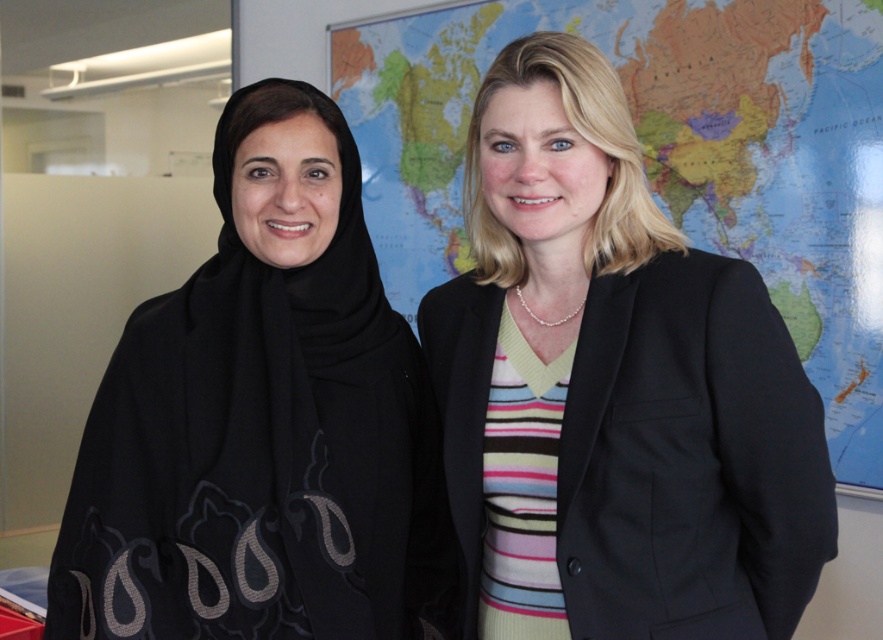
Consider the image. Between black matte scarf at left and map at center, which one is positioned lower?

black matte scarf at left

Is point (69, 616) positioned before point (828, 140)?

That is True.

You are a GUI agent. You are given a task and a screenshot of the screen. Output one action in this format:
    pyautogui.click(x=<x>, y=<y>)
    Task: Click on the black matte scarf at left
    Image resolution: width=883 pixels, height=640 pixels.
    Given the screenshot: What is the action you would take?
    pyautogui.click(x=263, y=422)